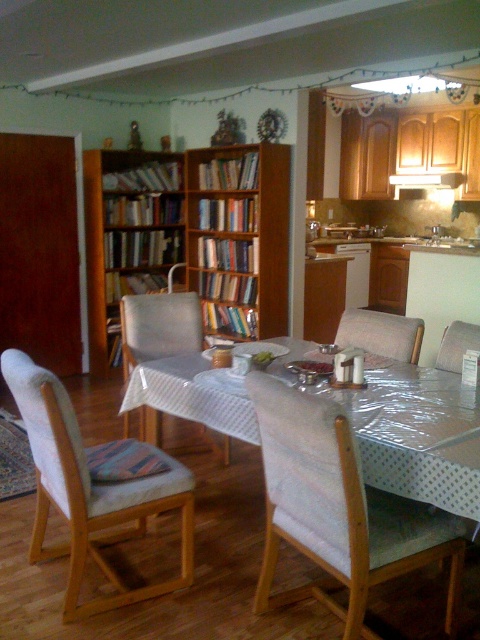
Question: Is brown wooden bookshelf at left below suede-like beige armchair at center?

Choices:
 (A) yes
 (B) no

Answer: (B)

Question: Which point is farther from the camera taking this photo?

Choices:
 (A) (73, 520)
 (B) (357, 324)
 (C) (170, 292)
 (D) (92, 227)

Answer: (D)

Question: Can you confirm if white fabric chair at center is wider than white fabric armchair at center?

Choices:
 (A) no
 (B) yes

Answer: (B)

Question: Which point is farther to the camera?

Choices:
 (A) 331,563
 (B) 182,314
 (C) 477,337
 (D) 66,472

Answer: (B)

Question: Where is white fabric chair at center located in relation to white fabric chair at left in the image?

Choices:
 (A) above
 (B) below

Answer: (B)

Question: Which point is farther to the camera?

Choices:
 (A) white fabric armchair at center
 (B) white fabric chair at center

Answer: (A)